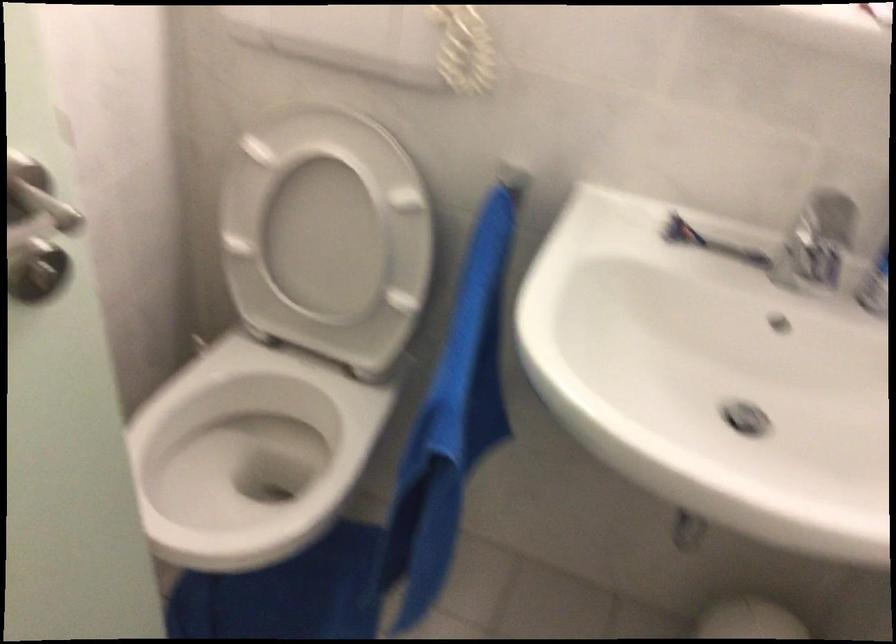
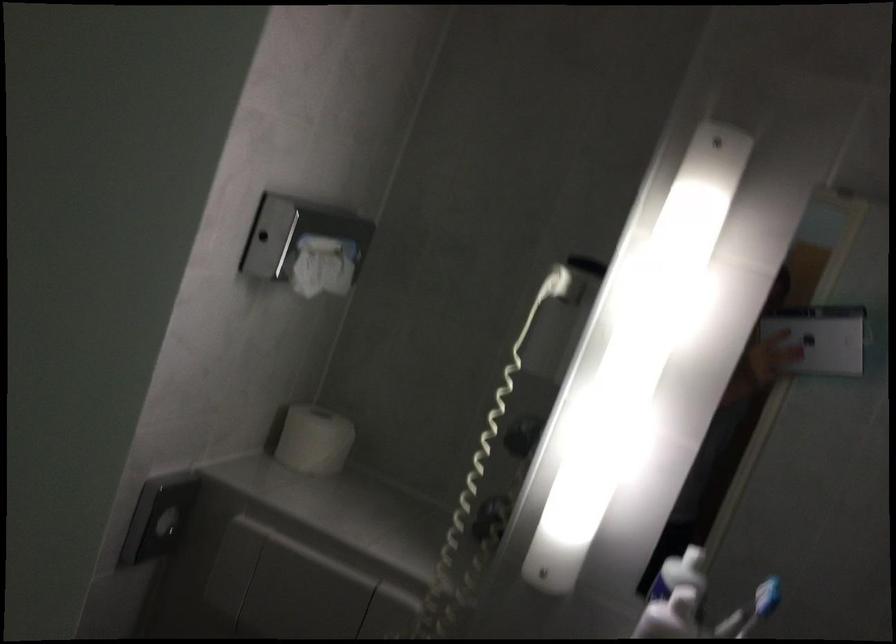
Question: The images are taken continuously from a first-person perspective. In which direction is your viewpoint rotating?

Choices:
 (A) Left
 (B) Right
 (C) Up
 (D) Down

Answer: (C)